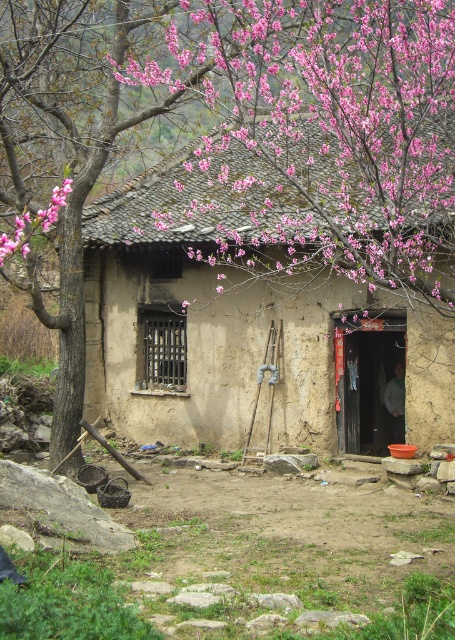
Does brown mud hut at center appear on the left side of pink bloom at upper center?

Yes, brown mud hut at center is to the left of pink bloom at upper center.

Locate an element on the screen. brown mud hut at center is located at coordinates (246, 317).